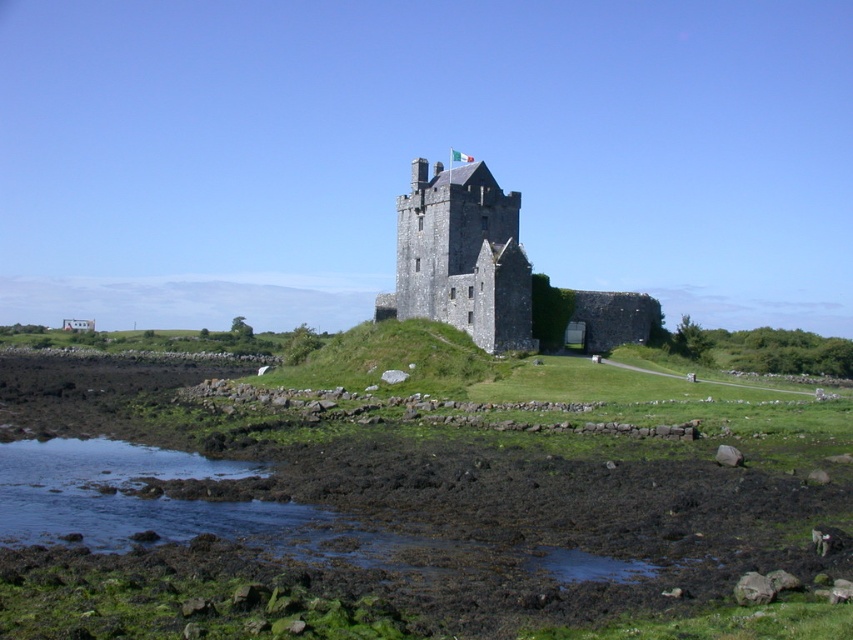
Question: Which point is closer to the camera?

Choices:
 (A) dark gray stone castle at center
 (B) black mud at lower left
 (C) clear water at lower left

Answer: (B)

Question: Among these objects, which one is farthest from the camera?

Choices:
 (A) dark gray stone castle at center
 (B) black mud at lower left
 (C) clear water at lower left

Answer: (A)

Question: Does black mud at lower left appear on the right side of dark gray stone castle at center?

Choices:
 (A) yes
 (B) no

Answer: (B)

Question: Does black mud at lower left appear under dark gray stone castle at center?

Choices:
 (A) no
 (B) yes

Answer: (B)

Question: Does black mud at lower left come behind dark gray stone castle at center?

Choices:
 (A) yes
 (B) no

Answer: (B)

Question: Which object appears farthest from the camera in this image?

Choices:
 (A) black mud at lower left
 (B) dark gray stone castle at center

Answer: (B)